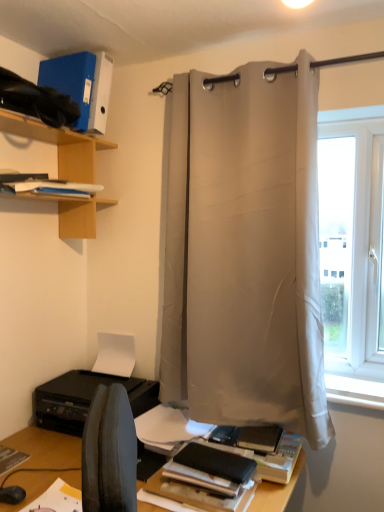
Question: Based on their sizes in the image, would you say black matte printer at lower left is bigger or smaller than white smooth window sill at lower right?

Choices:
 (A) small
 (B) big

Answer: (B)

Question: In the image, is black matte printer at lower left positioned in front of or behind white smooth window sill at lower right?

Choices:
 (A) front
 (B) behind

Answer: (B)

Question: Based on their relative distances, which object is farther from the woodenshelving at left?

Choices:
 (A) black matte printer at lower left
 (B) white matte paper at lower center
 (C) blue matte folder at upper left, arranged as the 1th paperback book when viewed from the left
 (D) white smooth window sill at lower right
 (E) white paper at left

Answer: (D)

Question: Which object is the closest to the matte black book at lower center, which is the second paperback book from back to front?

Choices:
 (A) white fabric curtain at center
 (B) white smooth window sill at lower right
 (C) black matte printer at lower left
 (D) blue matte folder at upper left, the second paperback book when ordered from front to back
 (E) woodenshelving at left

Answer: (C)